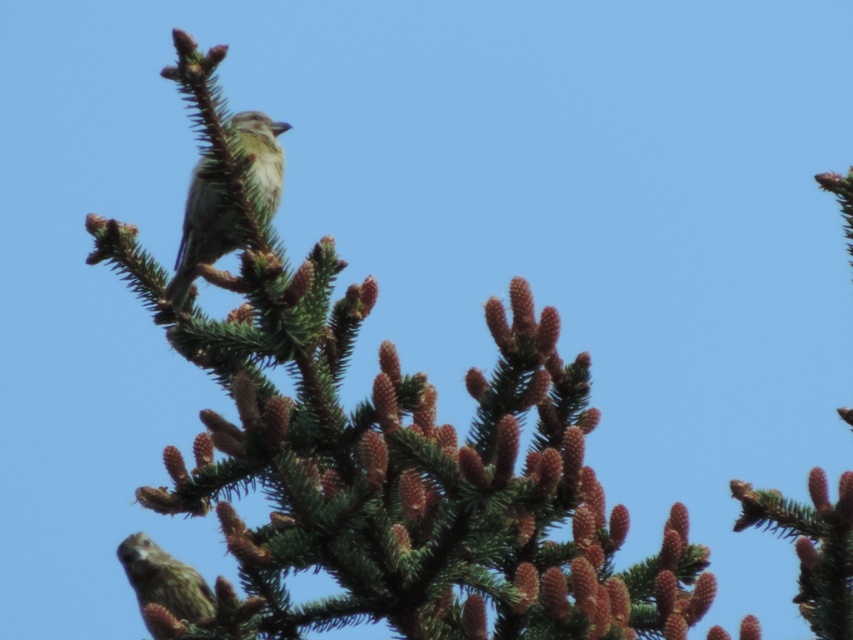
Between brown speckled feathers at center and green speckled feathers at upper center, which one has more height?

With more height is brown speckled feathers at center.

Can you confirm if brown speckled feathers at center is shorter than green speckled feathers at upper center?

No.

Where is `brown speckled feathers at center`? brown speckled feathers at center is located at coordinates (199, 236).

Locate an element on the screen. This screenshot has height=640, width=853. brown speckled feathers at center is located at coordinates (199, 236).

The width and height of the screenshot is (853, 640). Describe the element at coordinates (390, 458) in the screenshot. I see `green textured pine branch at upper center` at that location.

Is green textured pine branch at upper center bigger than green speckled feathers at upper center?

Correct, green textured pine branch at upper center is larger in size than green speckled feathers at upper center.

Where is `green textured pine branch at upper center`? This screenshot has height=640, width=853. green textured pine branch at upper center is located at coordinates (390, 458).

Who is positioned more to the right, green textured pine branch at upper center or brown speckled feathers at center?

green textured pine branch at upper center

Between green textured pine branch at upper center and brown speckled feathers at center, which one appears on the left side from the viewer's perspective?

Positioned to the left is brown speckled feathers at center.

Find the location of a particular element. green textured pine branch at upper center is located at coordinates (390, 458).

You are a GUI agent. You are given a task and a screenshot of the screen. Output one action in this format:
    pyautogui.click(x=<x>, y=<y>)
    Task: Click on the green textured pine branch at upper center
    Image resolution: width=853 pixels, height=640 pixels.
    Given the screenshot: What is the action you would take?
    pyautogui.click(x=390, y=458)